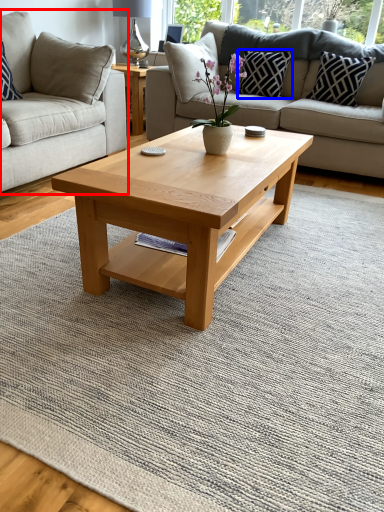
Question: Among these objects, which one is nearest to the camera, studio couch (highlighted by a red box) or pillow (highlighted by a blue box)?

Choices:
 (A) studio couch
 (B) pillow

Answer: (A)